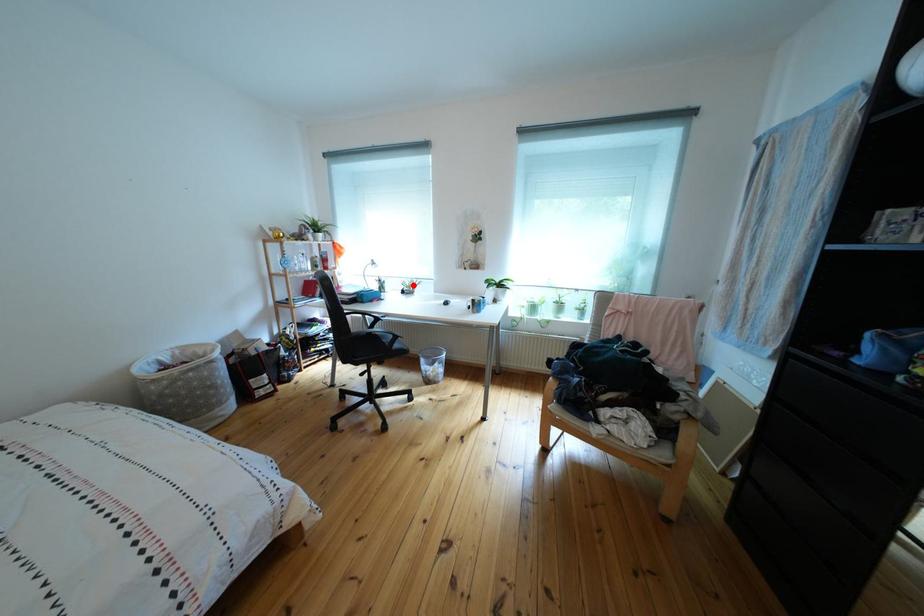
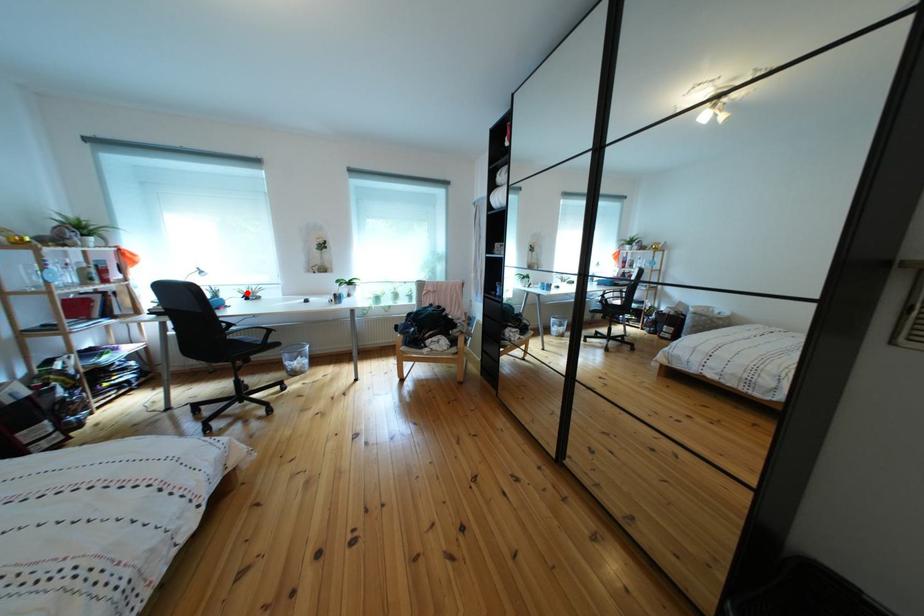
I am providing you with two images of the same scene from different viewpoints. A red point is marked on the first image and another point is marked on the second image. Are the points marked in image1 and image2 representing the same 3D position?

Yes